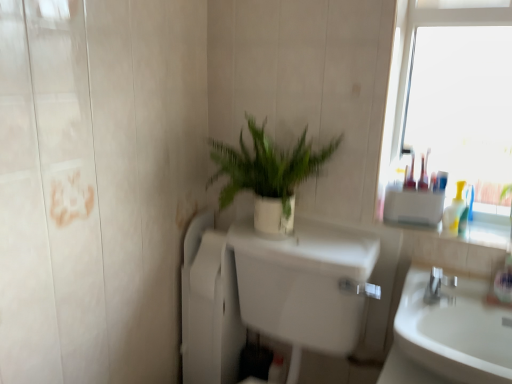
Question: Choose the correct answer: Is white matte plant pot at center inside translucent plastic bottles at right or outside it?

Choices:
 (A) outside
 (B) inside

Answer: (A)

Question: Considering the positions of point (279, 182) and point (457, 188), is point (279, 182) closer or farther from the camera than point (457, 188)?

Choices:
 (A) closer
 (B) farther

Answer: (A)

Question: Estimate the real-world distances between objects in this image. Which object is farther from the silver metallic faucet at right?

Choices:
 (A) translucent plastic bottles at right
 (B) white matte plant pot at center
 (C) white glossy toilet at center
 (D) white glossy sink at lower right

Answer: (B)

Question: Which is farther from the white matte plant pot at center?

Choices:
 (A) white glossy toilet at center
 (B) white glossy sink at lower right
 (C) translucent plastic bottles at right
 (D) silver metallic faucet at right

Answer: (D)